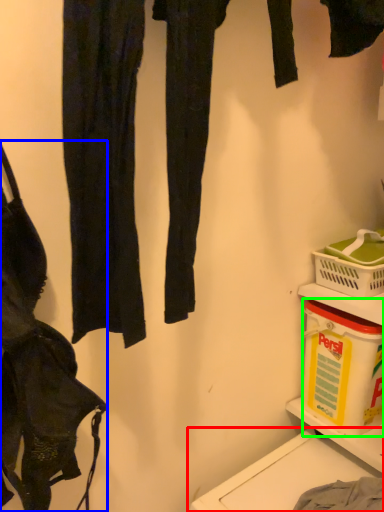
Question: Which is farther away from washing (highlighted by a red box)? handbag (highlighted by a blue box) or box (highlighted by a green box)?

Choices:
 (A) handbag
 (B) box

Answer: (A)